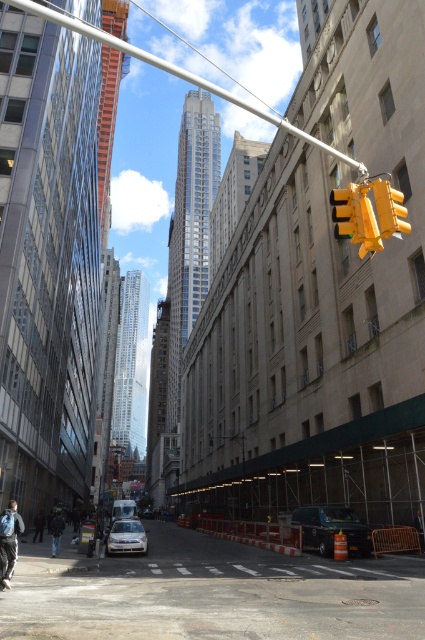
Question: Which object is closer to the camera taking this photo?

Choices:
 (A) yellow plastic traffic light at upper right
 (B) silver metallic sedan at center
 (C) metallic silver pole at upper center

Answer: (C)

Question: Can you confirm if silver metallic sedan at center is smaller than white matte car at lower center?

Choices:
 (A) no
 (B) yes

Answer: (B)

Question: Which of the following is the farthest from the observer?

Choices:
 (A) (217, 93)
 (B) (138, 541)

Answer: (A)

Question: Can you confirm if yellow plastic traffic light at upper right is positioned above white matte car at lower center?

Choices:
 (A) yes
 (B) no

Answer: (A)

Question: Can you confirm if metallic silver pole at upper center is bigger than black rubber van at lower center?

Choices:
 (A) no
 (B) yes

Answer: (B)

Question: Which object is closer to the camera taking this photo?

Choices:
 (A) black rubber van at lower center
 (B) metallic silver pole at upper center

Answer: (B)